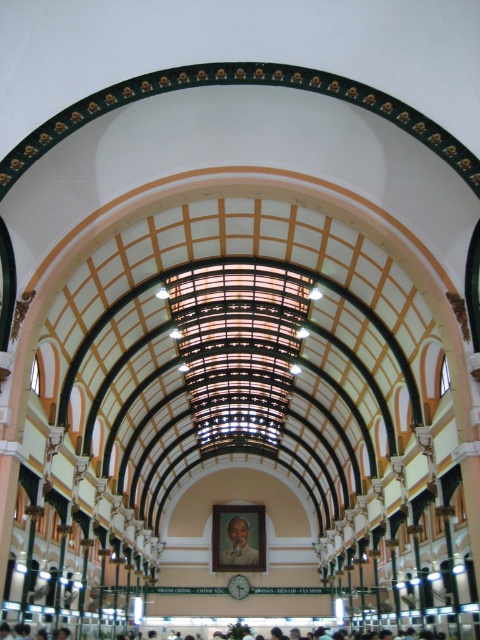
Based on the scene description, where is the smooth skin person at center located in terms of coordinates?

The smooth skin person at center is located at point coordinates of (186, 624).

You are standing in the grand arched building and see two points marked on the ceiling. The first point is at coordinates point [450,632] and the second is at point [245,548]. Which point is closer to you as you look up?

Point [450,632] is in front of point [245,548], so it is closer to you when looking up.

You are standing in the grand arched building and see a point marked at coordinates (186, 624). According to the image, where is this point located?

The point is located on the smooth skin person at center.